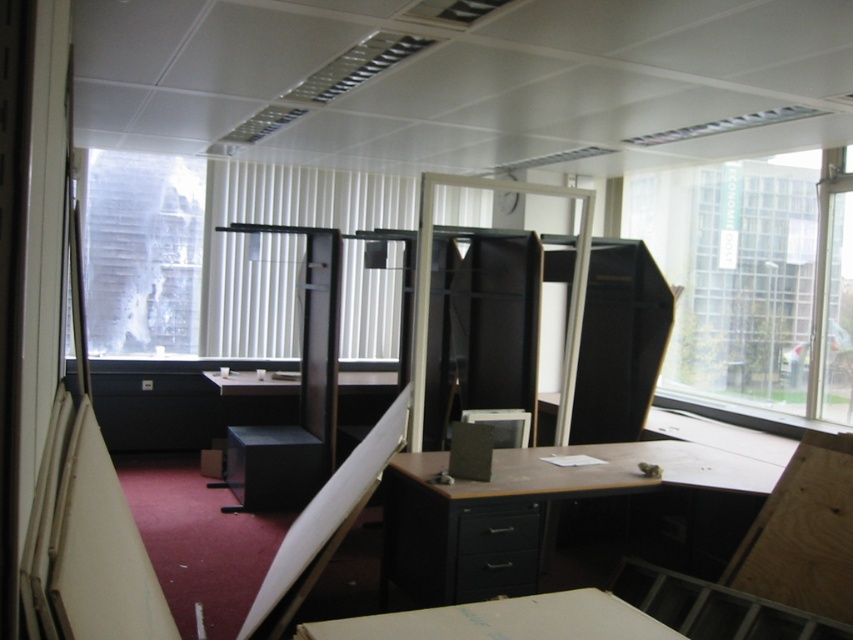
Question: Which of the following is the farthest from the observer?

Choices:
 (A) transparent glass window at upper right
 (B) transparent glass window at upper left

Answer: (B)

Question: Which object is positioned closest to the transparent glass window at upper left?

Choices:
 (A) transparent glass window at upper right
 (B) matte black desk at center

Answer: (B)

Question: Estimate the real-world distances between objects in this image. Which object is farther from the transparent glass window at upper right?

Choices:
 (A) matte black desk at center
 (B) transparent glass window at upper left

Answer: (B)

Question: Is matte black desk at center bigger than transparent glass window at upper left?

Choices:
 (A) yes
 (B) no

Answer: (A)

Question: Does transparent glass window at upper right appear over matte black desk at center?

Choices:
 (A) yes
 (B) no

Answer: (A)

Question: Considering the relative positions of transparent glass window at upper right and matte black desk at center in the image provided, where is transparent glass window at upper right located with respect to matte black desk at center?

Choices:
 (A) right
 (B) left

Answer: (A)